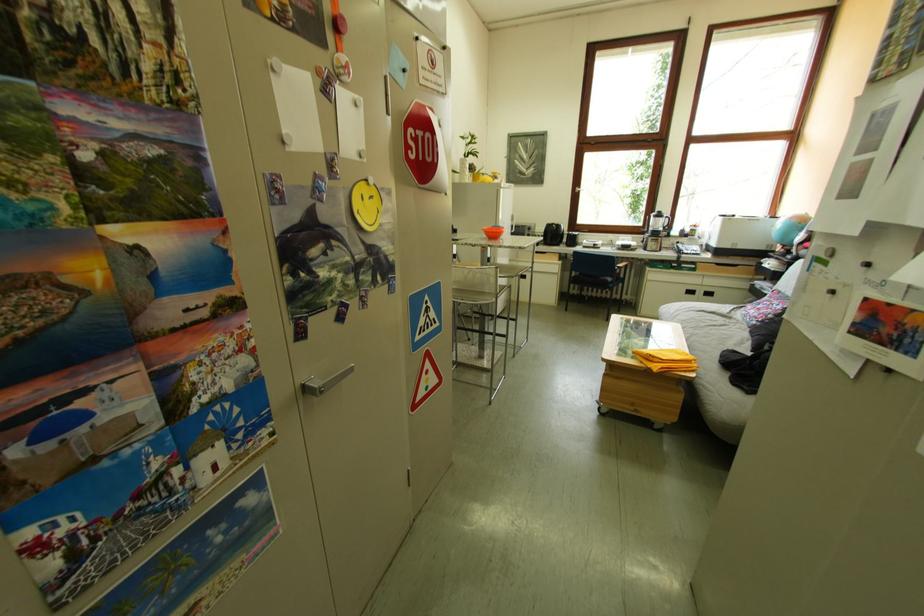
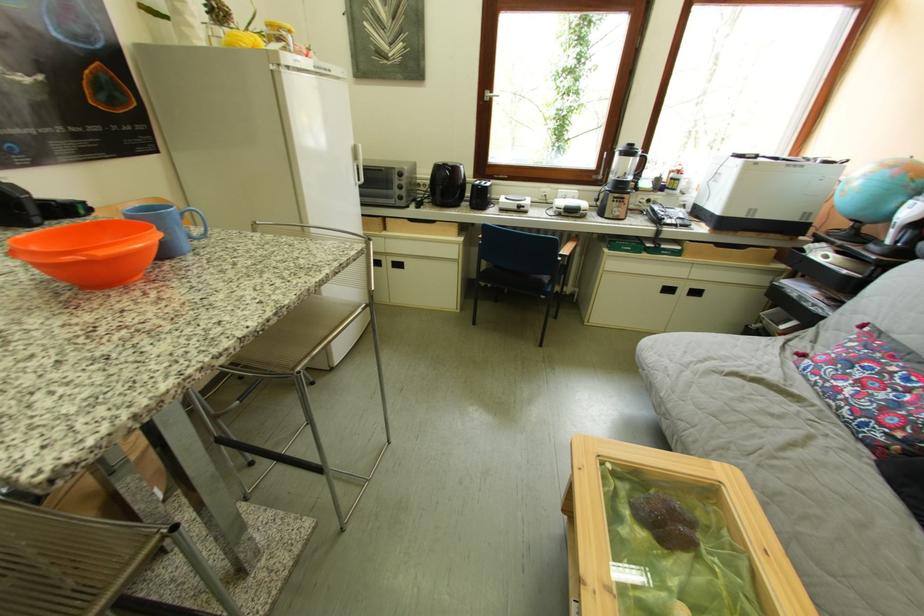
Find the pixel in the second image that matches pixel 562 229 in the first image.

(451, 171)